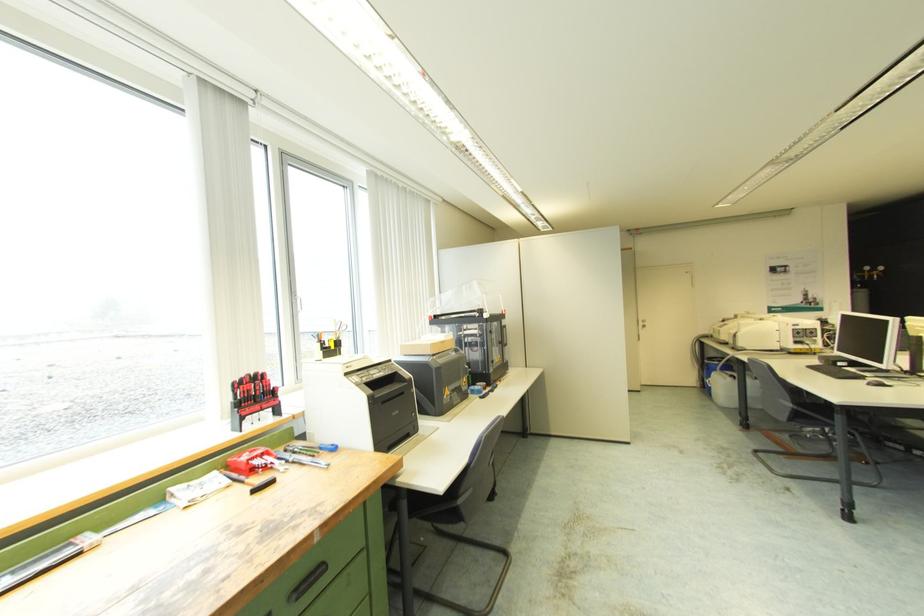
The height and width of the screenshot is (616, 924). Describe the element at coordinates (359, 403) in the screenshot. I see `the clear 3D printer cover` at that location.